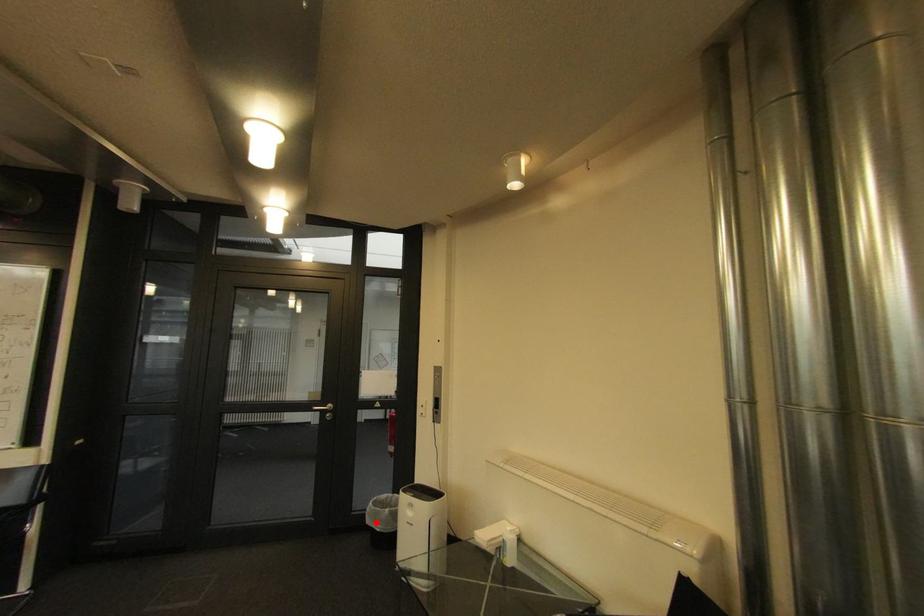
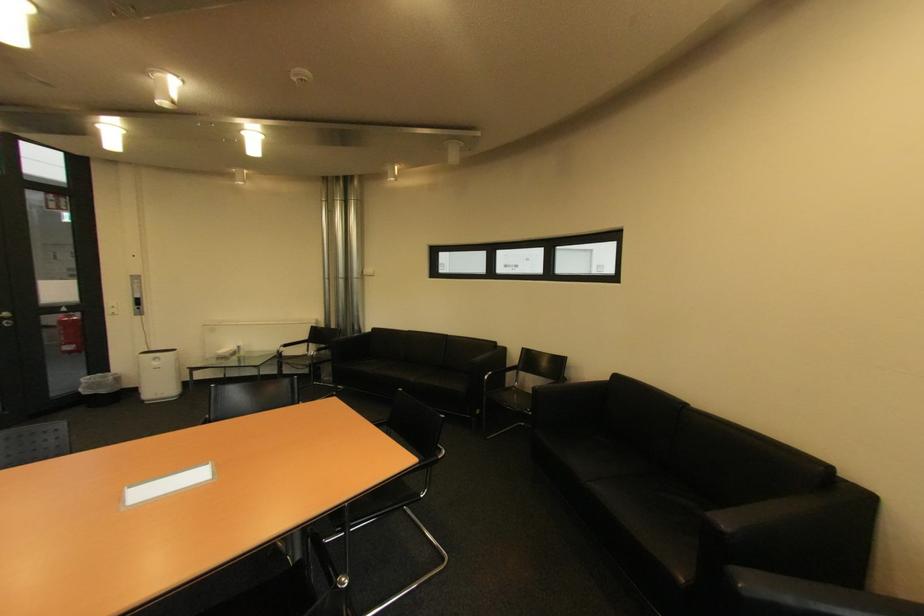
Question: I am providing you with two images of the same scene from different viewpoints. Image1 has a red point marked. In image2, the corresponding 3D location appears at what relative position? Reply with the corresponding letter.

Choices:
 (A) Closer
 (B) Farther

Answer: (A)